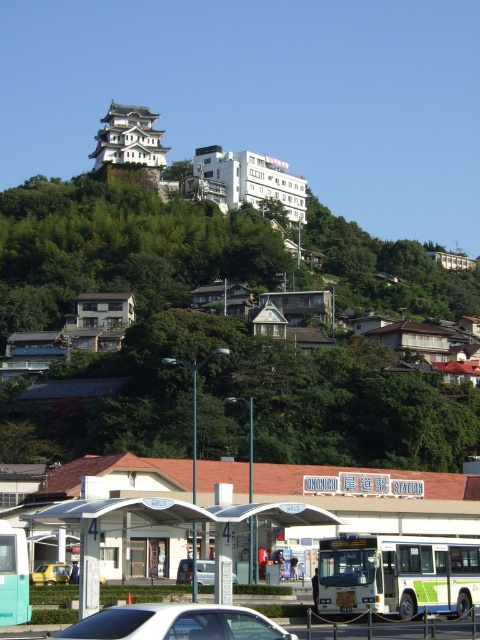
Looking at this image, you are a delivery driver who needs to park your white matte car at lower center in a specific spot marked at coordinates point 0.975, 0.367. Can you confirm if your current position matches the required coordinates?

The white matte car at lower center is already positioned at point (176, 624), so the current position matches the required coordinates.

You are a delivery person who needs to park your vehicle between the white metallic bus at lower center and the silver metallic van at center. Which vehicle should you park behind to ensure you have enough clearance for your 2.5m tall truck?

The white metallic bus at lower center has a lesser height compared to the silver metallic van at center. Therefore, you should park behind the white metallic bus at lower center since it is shorter, allowing enough clearance for your 2.5m tall truck.

You are a pedestrian standing at the edge of the road looking towards the white plastic bus station at lower center and the white matte car at lower center. Which object is closer to the road?

The white plastic bus station at lower center is located below the white matte car at lower center, so the white plastic bus station at lower center is closer to the road.